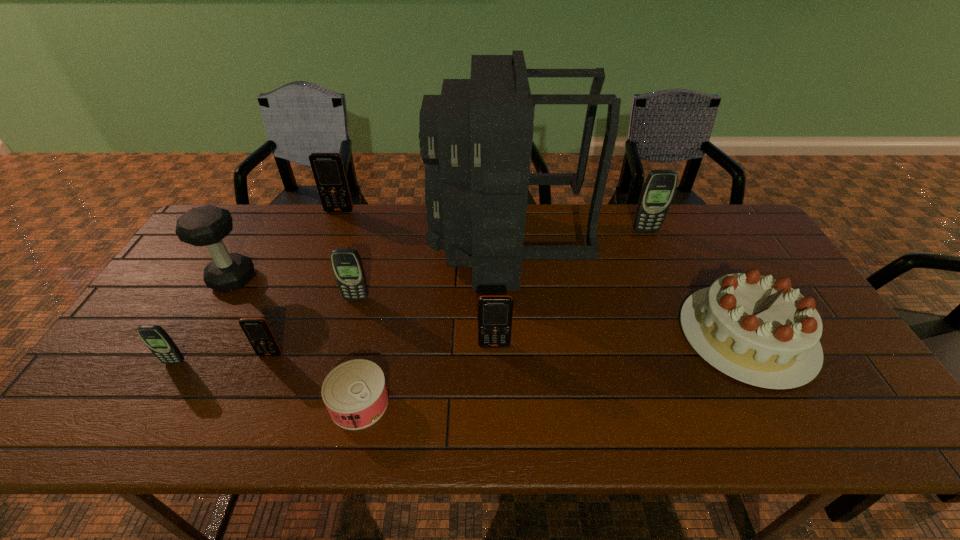
The image size is (960, 540). I want to click on the tallest object, so click(x=476, y=137).

Where is `backpack`? backpack is located at coordinates (476, 137).

At what (x,y) coordinates should I click in order to perform the action: click on the biggest orange cellular telephone. Please return your answer as a coordinate pair (x, y). This screenshot has height=540, width=960. Looking at the image, I should click on (327, 167).

Locate an element on the screen. the farthest cellular telephone is located at coordinates (327, 167).

Locate an element on the screen. The width and height of the screenshot is (960, 540). the biggest gray cellular telephone is located at coordinates (658, 190).

You are a GUI agent. You are given a task and a screenshot of the screen. Output one action in this format:
    pyautogui.click(x=<x>, y=<y>)
    Task: Click on the rightmost cellular telephone
    This screenshot has width=960, height=540.
    Given the screenshot: What is the action you would take?
    pyautogui.click(x=658, y=190)

Where is `dumbbell`? The height and width of the screenshot is (540, 960). dumbbell is located at coordinates (206, 226).

Locate an element on the screen. This screenshot has width=960, height=540. the second gray cellular telephone from right to left is located at coordinates (347, 265).

Locate an element on the screen. the second farthest gray cellular telephone is located at coordinates (347, 265).

I want to click on the fifth cellular telephone from left to right, so click(495, 312).